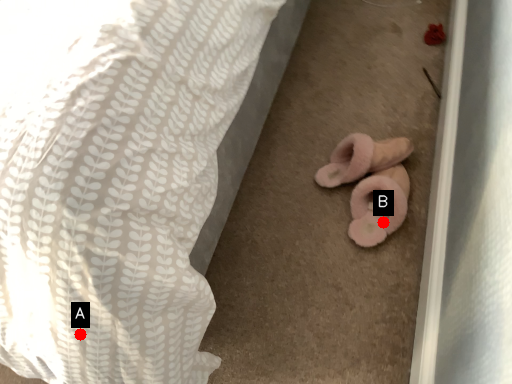
Question: Two points are circled on the image, labeled by A and B beside each circle. Which point is closer to the camera taking this photo?

Choices:
 (A) A is closer
 (B) B is closer

Answer: (A)